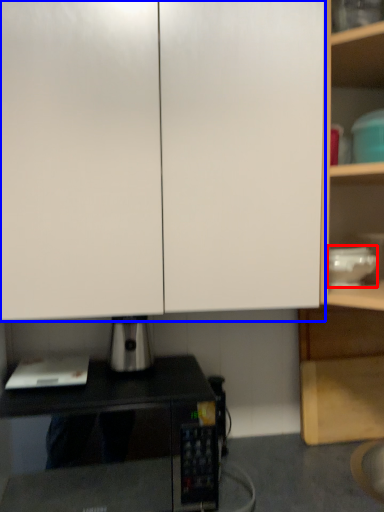
Question: Which object appears closest to the camera in this image, appliance (highlighted by a red box) or cabinetry (highlighted by a blue box)?

Choices:
 (A) appliance
 (B) cabinetry

Answer: (B)